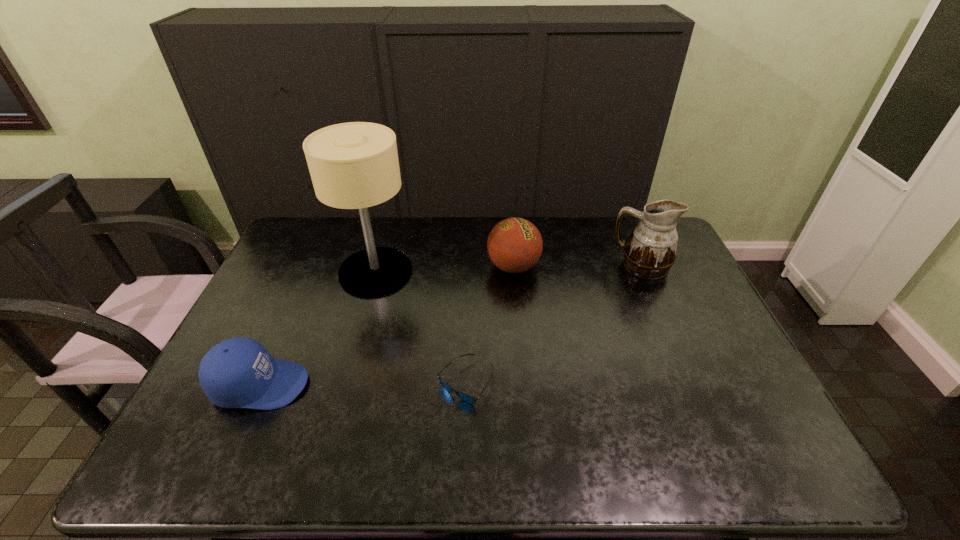
Find the location of `free spot that satisfies the following two spatial constraints: 1. at the front of the sunglasses showing the lenses; 2. on the front-facing side of the second shortest object`. free spot that satisfies the following two spatial constraints: 1. at the front of the sunglasses showing the lenses; 2. on the front-facing side of the second shortest object is located at coordinates (466, 385).

You are a GUI agent. You are given a task and a screenshot of the screen. Output one action in this format:
    pyautogui.click(x=<x>, y=<y>)
    Task: Click on the free space that satisfies the following two spatial constraints: 1. from the spout of the fourth shortest object; 2. on the front side of the table lamp
    This screenshot has width=960, height=540.
    Given the screenshot: What is the action you would take?
    [644, 272]

This screenshot has width=960, height=540. In order to click on vacant region that satisfies the following two spatial constraints: 1. at the front of the shortest object showing the lenses; 2. on the front-facing side of the cap in this screenshot , I will do `click(466, 385)`.

This screenshot has height=540, width=960. Find the location of `vacant space that satisfies the following two spatial constraints: 1. from the spout of the pitcher; 2. at the front of the shortest object showing the lenses`. vacant space that satisfies the following two spatial constraints: 1. from the spout of the pitcher; 2. at the front of the shortest object showing the lenses is located at coordinates (692, 382).